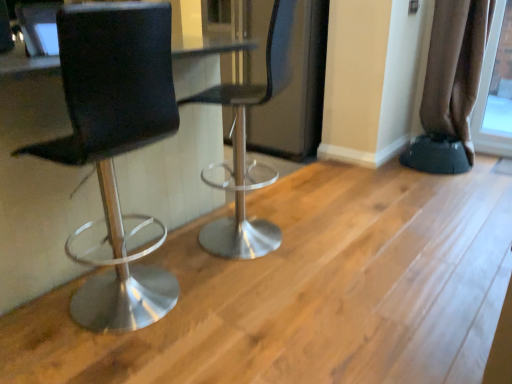
Question: From their relative heights in the image, would you say metallic silver stool at center, which is the first chair from right to left, is taller or shorter than transparent glass screen door at center?

Choices:
 (A) tall
 (B) short

Answer: (B)

Question: In terms of width, does metallic silver stool at center, the 2th chair from the left, look wider or thinner when compared to transparent glass screen door at center?

Choices:
 (A) wide
 (B) thin

Answer: (B)

Question: Considering the real-world distances, which object is closest to the metallic silver stool at center, which is the first chair from right to left?

Choices:
 (A) matte black stool at left, marked as the second chair in a right-to-left arrangement
 (B) brown fabric curtain at right
 (C) black rubber step stool at lower right
 (D) transparent glass screen door at center

Answer: (A)

Question: Which of these objects is positioned farthest from the transparent glass screen door at center?

Choices:
 (A) metallic silver stool at center, the 2th chair from the left
 (B) matte black stool at left, which ranks as the 1th chair in left-to-right order
 (C) black rubber step stool at lower right
 (D) brown fabric curtain at right

Answer: (B)